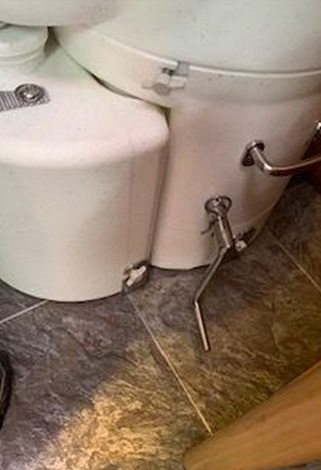
You are a GUI agent. You are given a task and a screenshot of the screen. Output one action in this format:
    pyautogui.click(x=<x>, y=<y>)
    Task: Click on the handle
    This screenshot has height=470, width=321.
    Given the screenshot: What is the action you would take?
    pyautogui.click(x=258, y=159)